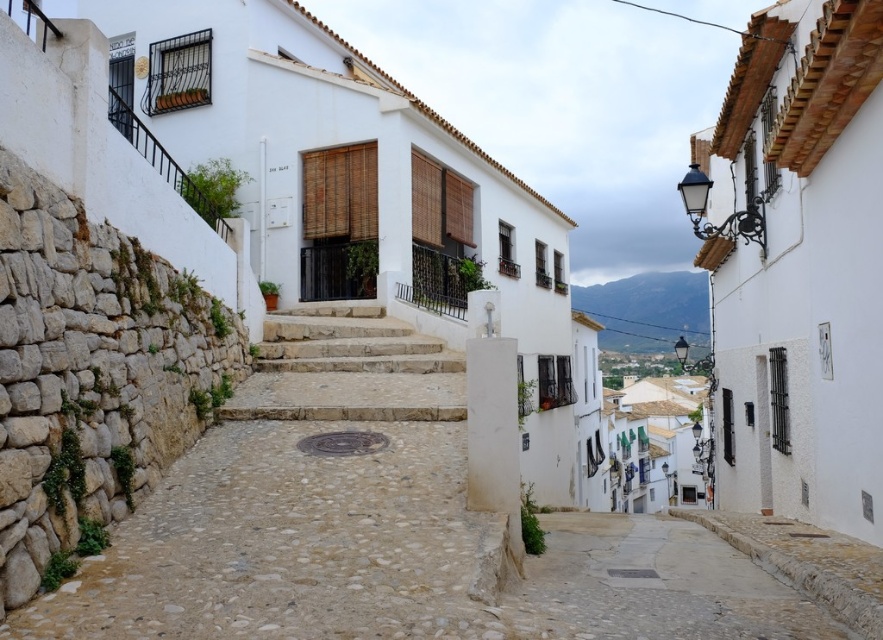
Question: Among these objects, which one is nearest to the camera?

Choices:
 (A) smooth stone path at lower center
 (B) natural stone stairs at center
 (C) natural stone path at center

Answer: (C)

Question: Among these points, which one is nearest to the camera?

Choices:
 (A) (374, 378)
 (B) (466, 616)
 (C) (731, 572)

Answer: (B)

Question: Is natural stone path at center above natural stone stairs at center?

Choices:
 (A) yes
 (B) no

Answer: (B)

Question: Is natural stone path at center above smooth stone path at lower center?

Choices:
 (A) yes
 (B) no

Answer: (A)

Question: Estimate the real-world distances between objects in this image. Which object is closer to the smooth stone path at lower center?

Choices:
 (A) natural stone stairs at center
 (B) natural stone path at center

Answer: (B)

Question: Observing the image, what is the correct spatial positioning of natural stone path at center in reference to natural stone stairs at center?

Choices:
 (A) left
 (B) right

Answer: (A)